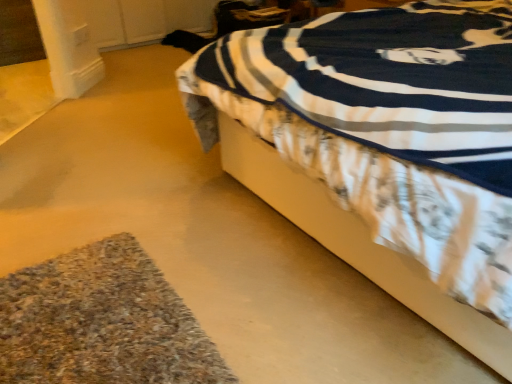
Measure the distance between white textured bed at center and camera.

28.43 inches.

Locate an element on the screen. white textured bed at center is located at coordinates (383, 148).

The image size is (512, 384). What do you see at coordinates (383, 148) in the screenshot?
I see `white textured bed at center` at bounding box center [383, 148].

Where is `white textured bed at center`? The image size is (512, 384). white textured bed at center is located at coordinates pos(383,148).